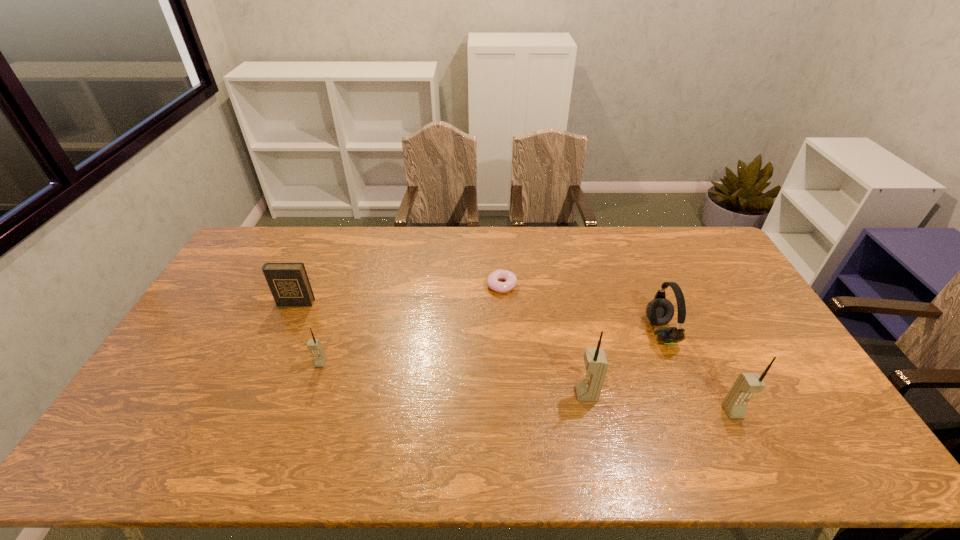
The height and width of the screenshot is (540, 960). I want to click on the shortest object, so click(x=510, y=279).

This screenshot has height=540, width=960. Find the location of `doughnut`. doughnut is located at coordinates (510, 279).

At what (x,y) coordinates should I click in order to perform the action: click on vacant region located on the front of the shortest cellular telephone, where the keypad is located. Please return your answer as a coordinate pair (x, y). The height and width of the screenshot is (540, 960). Looking at the image, I should click on (312, 389).

The image size is (960, 540). Identify the location of free space located 0.100m on the front of the second farthest cellular telephone, where the keypad is located. [x=539, y=394].

The image size is (960, 540). What are the coordinates of `free space located on the front of the second farthest cellular telephone, where the keypad is located` in the screenshot? It's located at (513, 394).

This screenshot has width=960, height=540. What are the coordinates of `free point located 0.140m on the front of the second farthest cellular telephone, where the keypad is located` in the screenshot? It's located at (524, 394).

Locate an element on the screen. The height and width of the screenshot is (540, 960). vacant space located on the front cover of the leftmost object is located at coordinates (248, 410).

In order to click on free space located 0.250m on the ear cups of the headset in this screenshot , I will do `click(565, 332)`.

Identify the location of vacant region located on the ear cups of the headset. point(552,332).

The height and width of the screenshot is (540, 960). In order to click on vacant space positioned on the ear cups of the headset in this screenshot , I will do `click(614, 332)`.